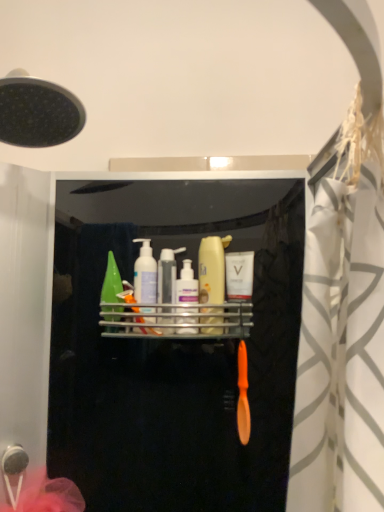
Locate an element on the screen. The height and width of the screenshot is (512, 384). free space above metallic silver shelf at center (from a real-world perspective) is located at coordinates (178, 297).